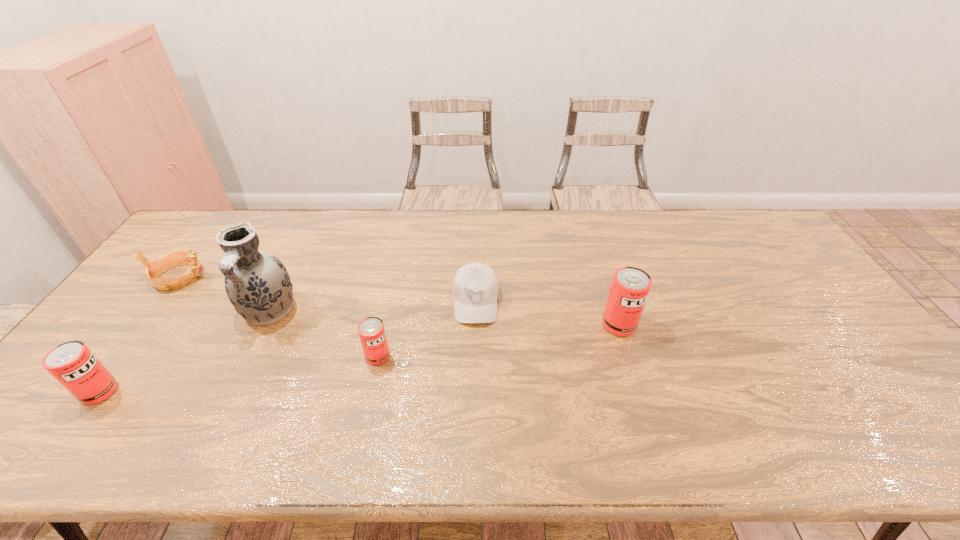
Locate an element on the screen. free space between the baseball cap and the tiara is located at coordinates (327, 289).

The image size is (960, 540). Find the location of `vacant area that lies between the fourth object from left to right and the fifth object from left to right`. vacant area that lies between the fourth object from left to right and the fifth object from left to right is located at coordinates (426, 328).

Find the location of `vacant space that's between the nearest object and the tiara`. vacant space that's between the nearest object and the tiara is located at coordinates (139, 334).

You are a GUI agent. You are given a task and a screenshot of the screen. Output one action in this format:
    pyautogui.click(x=<x>, y=<y>)
    Task: Click on the free space between the shortest can and the farthest can
    The width and height of the screenshot is (960, 540).
    Given the screenshot: What is the action you would take?
    pyautogui.click(x=498, y=340)

I want to click on free spot between the second tallest can and the rightmost object, so click(359, 358).

Where is `object that can be found as the third closest to the shortest can`? The height and width of the screenshot is (540, 960). object that can be found as the third closest to the shortest can is located at coordinates (630, 286).

Locate an element on the screen. object that stands as the second closest to the baseball cap is located at coordinates (630, 286).

You are a GUI agent. You are given a task and a screenshot of the screen. Output one action in this format:
    pyautogui.click(x=<x>, y=<y>)
    Task: Click on the closest can to the second object from right to left
    Image resolution: width=960 pixels, height=540 pixels.
    Given the screenshot: What is the action you would take?
    pyautogui.click(x=371, y=330)

Image resolution: width=960 pixels, height=540 pixels. What are the coordinates of `can that stands as the second closest to the nearest object` in the screenshot? It's located at (630, 286).

Where is `vacant region that satisfies the following two spatial constraints: 1. on the back side of the farthest can; 2. on the left side of the third object from right to left`? The image size is (960, 540). vacant region that satisfies the following two spatial constraints: 1. on the back side of the farthest can; 2. on the left side of the third object from right to left is located at coordinates (384, 325).